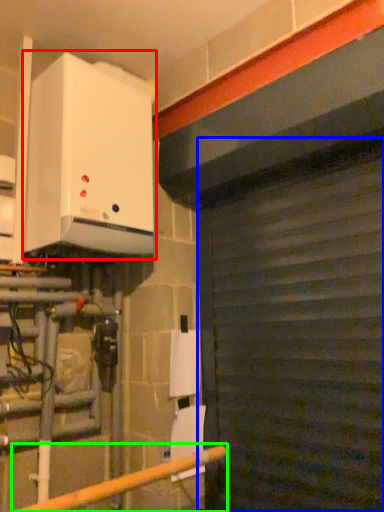
Question: Considering the real-world distances, which object is closest to home appliance (highlighted by a red box)? garage door (highlighted by a blue box) or rail (highlighted by a green box).

Choices:
 (A) garage door
 (B) rail

Answer: (A)